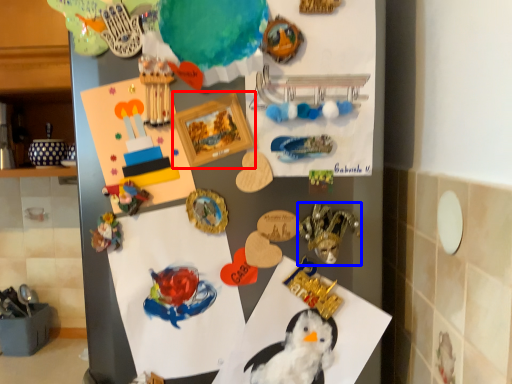
Question: Which object appears closest to the camera in this image, picture frame (highlighted by a red box) or toy (highlighted by a blue box)?

Choices:
 (A) picture frame
 (B) toy

Answer: (A)